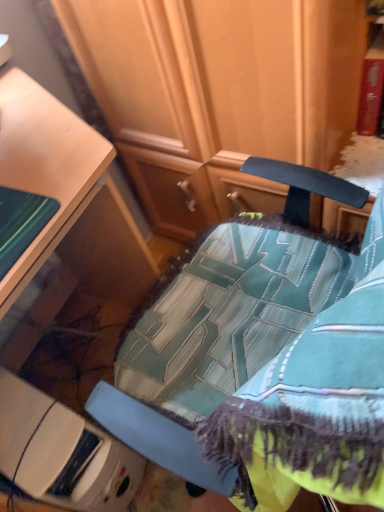
Question: In the image, is teal fabric chair at center positioned in front of or behind white plastic container at lower left?

Choices:
 (A) behind
 (B) front

Answer: (B)

Question: Would you say teal fabric chair at center is inside or outside white plastic container at lower left?

Choices:
 (A) outside
 (B) inside

Answer: (A)

Question: Visually, is teal fabric chair at center positioned to the left or to the right of white plastic container at lower left?

Choices:
 (A) right
 (B) left

Answer: (A)

Question: Considering the positions of point (81, 460) and point (347, 426), is point (81, 460) closer or farther from the camera than point (347, 426)?

Choices:
 (A) closer
 (B) farther

Answer: (B)

Question: From the image's perspective, relative to teal fabric chair at center, is white plastic container at lower left above or below?

Choices:
 (A) below
 (B) above

Answer: (A)

Question: In the image, is white plastic container at lower left positioned in front of or behind teal fabric chair at center?

Choices:
 (A) front
 (B) behind

Answer: (B)

Question: Is white plastic container at lower left inside or outside of teal fabric chair at center?

Choices:
 (A) outside
 (B) inside

Answer: (A)